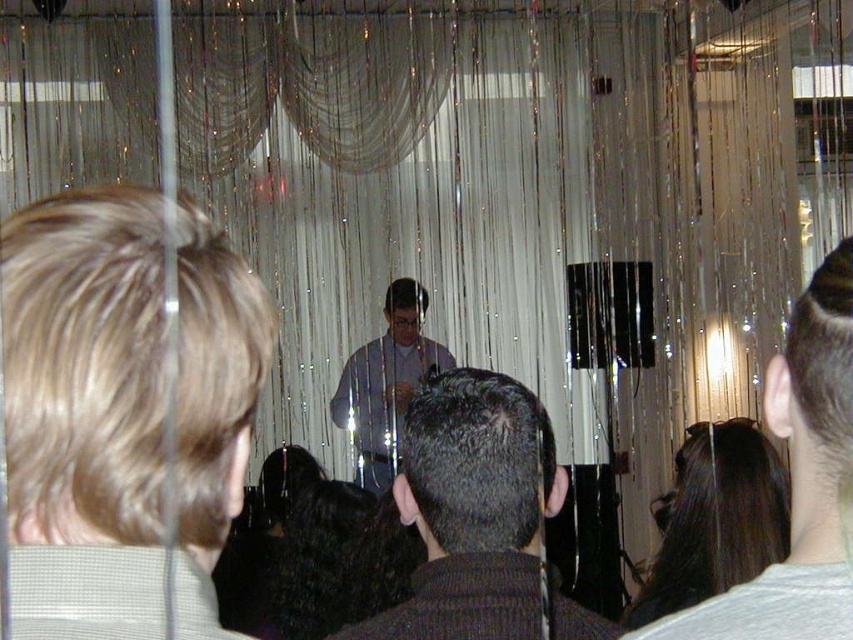
From the picture: You are sitting in the audience and want to see the speaker clearly. Which object, the dark brown hair at center or the matte gray shirt at center, is closer to you?

The dark brown hair at center is closer to you because it is in front of the matte gray shirt at center.

You are sitting in the audience and notice two features of the presenter at center. Which one, the dark gray knit sweater at center or the dark brown hair at center, is located lower on the presenter?

The dark gray knit sweater at center is positioned under dark brown hair at center, so the dark gray knit sweater at center is lower on the presenter.